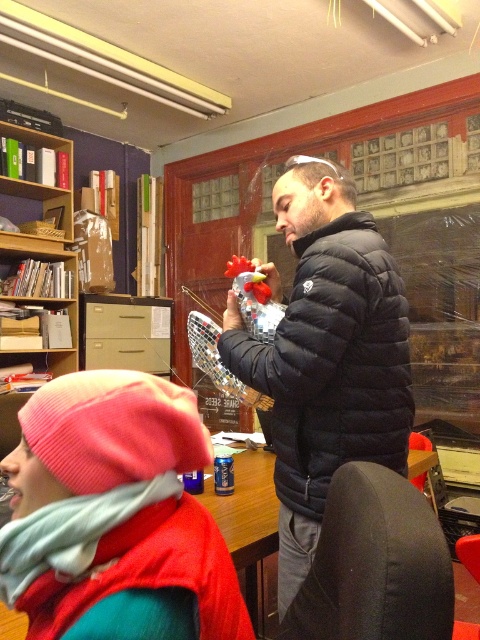
Question: Does pink knit beanie at upper left have a smaller size compared to wooden table at center?

Choices:
 (A) no
 (B) yes

Answer: (B)

Question: Which point appears farthest from the camera in this image?

Choices:
 (A) (324, 227)
 (B) (60, 243)

Answer: (B)

Question: Which is farther from the wooden table at center?

Choices:
 (A) wooden bookshelf at upper left
 (B) pink knit beanie at upper left

Answer: (A)

Question: Is pink knit beanie at upper left above black puffy jacket at center?

Choices:
 (A) yes
 (B) no

Answer: (B)

Question: Can you confirm if pink knit beanie at upper left is bigger than wooden table at center?

Choices:
 (A) no
 (B) yes

Answer: (A)

Question: Which of the following is the closest to the observer?

Choices:
 (A) wooden bookshelf at upper left
 (B) wooden table at center

Answer: (B)